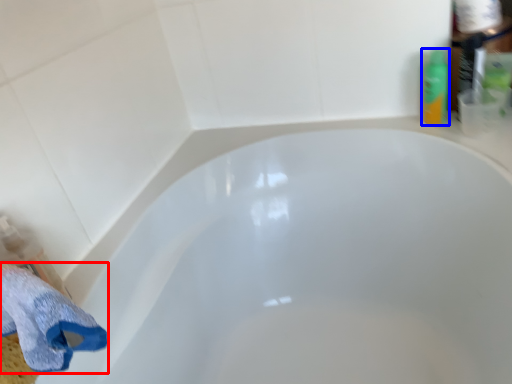
Question: Which object is further to the camera taking this photo, bath towel (highlighted by a red box) or toiletry (highlighted by a blue box)?

Choices:
 (A) bath towel
 (B) toiletry

Answer: (B)